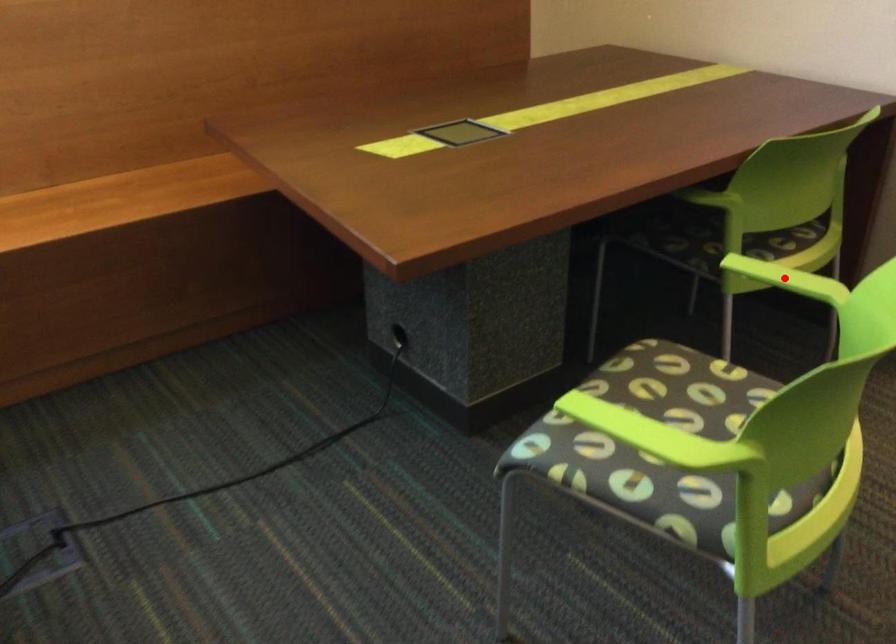
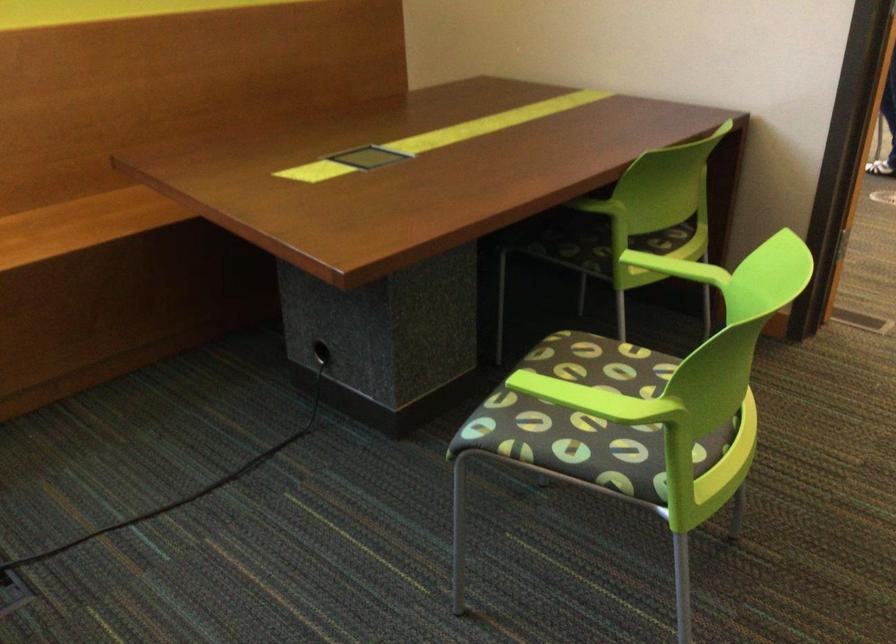
Question: I am providing you with two images of the same scene from different viewpoints. In image1, a red point is highlighted. Considering the same 3D point in image2, which of the following is correct?

Choices:
 (A) It is closer
 (B) It is farther

Answer: (B)